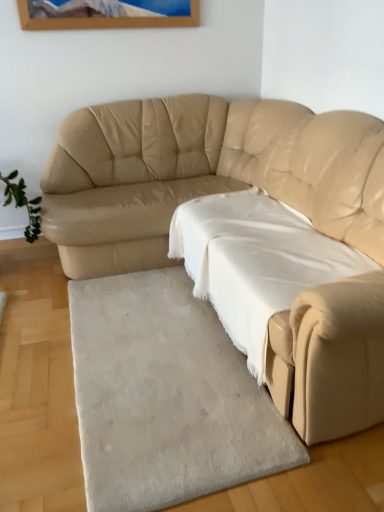
Question: Is beige leather couch at center inside white soft rug at lower center?

Choices:
 (A) no
 (B) yes

Answer: (A)

Question: Does white soft rug at lower center appear on the right side of beige leather couch at center?

Choices:
 (A) no
 (B) yes

Answer: (A)

Question: Does white soft rug at lower center turn towards beige leather couch at center?

Choices:
 (A) yes
 (B) no

Answer: (A)

Question: Is white soft rug at lower center smaller than beige leather couch at center?

Choices:
 (A) no
 (B) yes

Answer: (B)

Question: From a real-world perspective, is white soft rug at lower center on top of beige leather couch at center?

Choices:
 (A) no
 (B) yes

Answer: (A)

Question: Is white soft rug at lower center thinner than beige leather couch at center?

Choices:
 (A) yes
 (B) no

Answer: (A)

Question: Considering the relative sizes of white cotton sheet at center and white soft rug at lower center in the image provided, is white cotton sheet at center bigger than white soft rug at lower center?

Choices:
 (A) no
 (B) yes

Answer: (B)

Question: Is white cotton sheet at center far away from white soft rug at lower center?

Choices:
 (A) no
 (B) yes

Answer: (A)

Question: Can you confirm if white cotton sheet at center is wider than white soft rug at lower center?

Choices:
 (A) yes
 (B) no

Answer: (B)

Question: Can you confirm if white cotton sheet at center is positioned to the left of white soft rug at lower center?

Choices:
 (A) no
 (B) yes

Answer: (A)

Question: Can you confirm if white cotton sheet at center is thinner than white soft rug at lower center?

Choices:
 (A) no
 (B) yes

Answer: (B)

Question: Could you tell me if white cotton sheet at center is turned towards white soft rug at lower center?

Choices:
 (A) no
 (B) yes

Answer: (A)

Question: Can you confirm if white cotton sheet at center is thinner than beige leather couch at center?

Choices:
 (A) yes
 (B) no

Answer: (A)